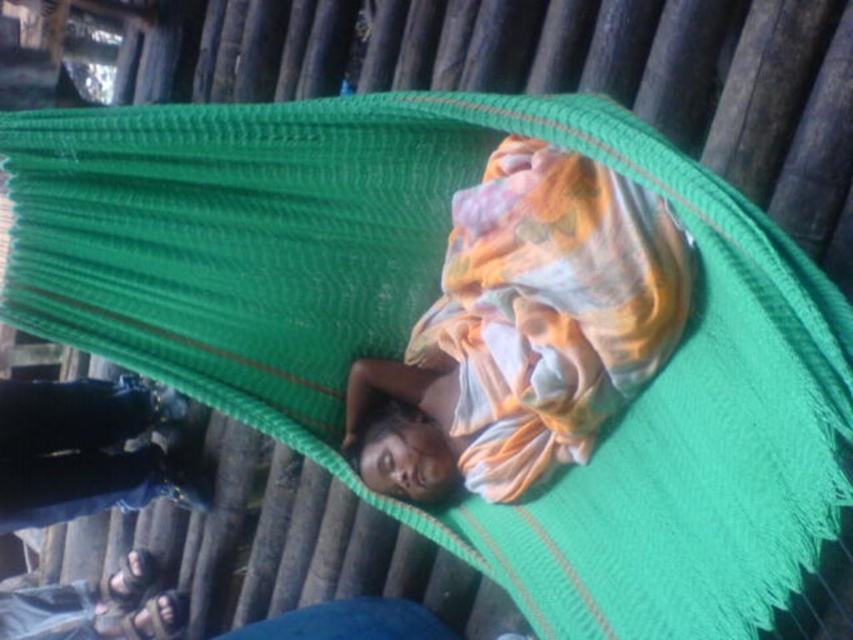
You are a tailor who needs to determine if the multicolored fabric at center can be used to make a new pair of denim pants at lower left. Based on the image, is the fabric wide enough?

The multicolored fabric at center might be wider than denim pants at lower left, so it could potentially be wide enough to make a new pair of denim pants at lower left.

In the scene shown: You are a photographer setting up a shot of the scene. You need to ensure that the multicolored fabric at center and the denim pants at lower left are both visible in the frame. Given their height differences, which object should you focus on first to ensure both are in focus?

The multicolored fabric at center is taller than the denim pants at lower left. To ensure both are in focus, you should focus on the multicolored fabric at center first, as it is the taller object and will require adjusting the depth of field to include the shorter denim pants at lower left.

What is the color of the fabric at the point marked by the coordinates (525, 330)?

The fabric at the point marked by the coordinates (525, 330) is multicolored.